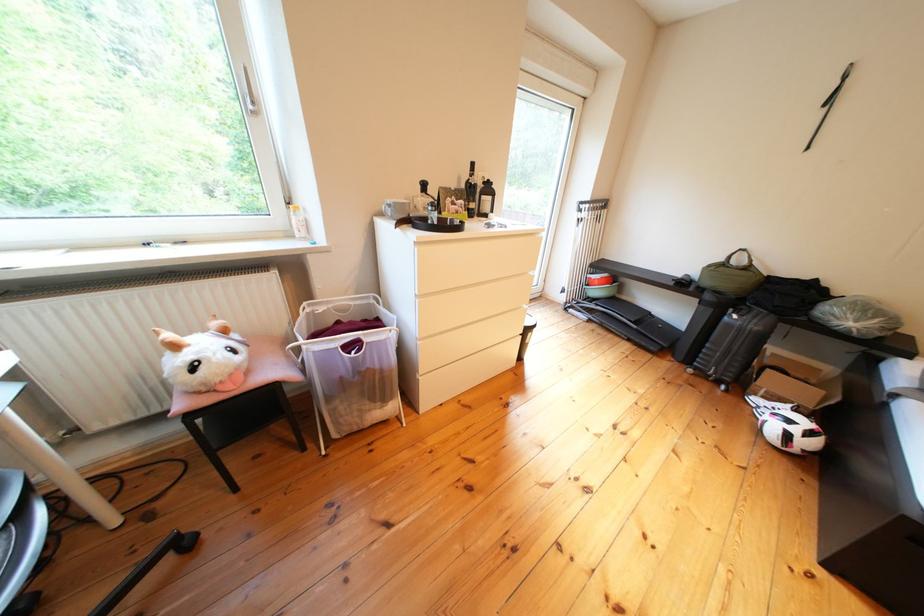
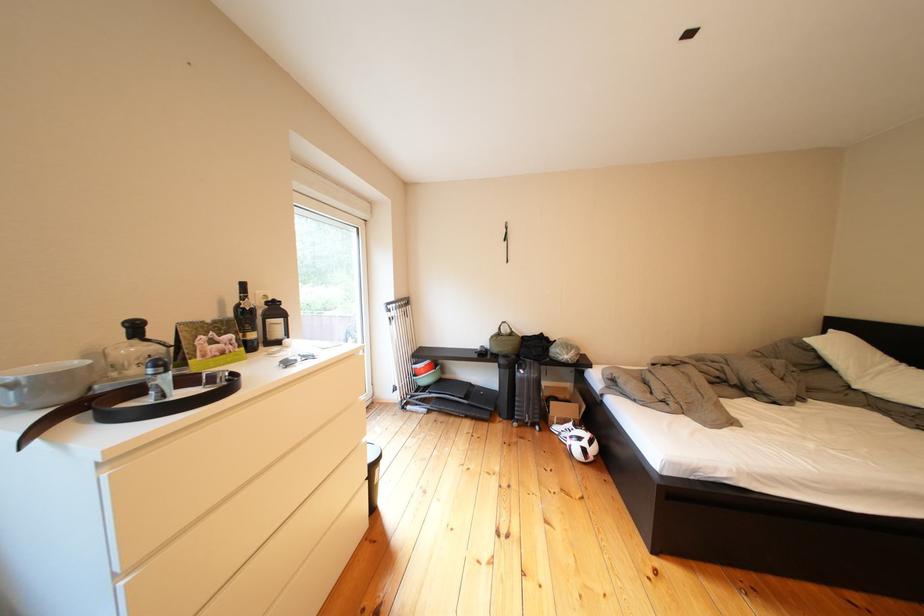
In the second image, find the point that corresponds to pixel 438 199 in the first image.

(150, 345)